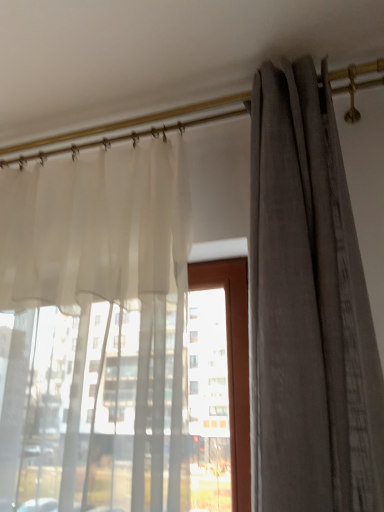
Locate an element on the screen. gray textured curtain at right, which is the 1th curtain in right-to-left order is located at coordinates (308, 309).

What do you see at coordinates (308, 309) in the screenshot? I see `gray textured curtain at right, which is the 1th curtain in right-to-left order` at bounding box center [308, 309].

Measure the distance between point (260, 86) and camera.

The distance of point (260, 86) from camera is 3.66 feet.

This screenshot has width=384, height=512. In order to click on translucent white curtain at left, placed as the 2th curtain when sorted from right to left in this screenshot , I will do `click(96, 332)`.

How much space does translucent white curtain at left, placed as the 2th curtain when sorted from right to left, occupy horizontally?

translucent white curtain at left, placed as the 2th curtain when sorted from right to left, is 11.16 inches in width.

How much space does translucent white curtain at left, placed as the 2th curtain when sorted from right to left, occupy vertically?

translucent white curtain at left, placed as the 2th curtain when sorted from right to left, is 3.54 feet in height.

The width and height of the screenshot is (384, 512). What do you see at coordinates (96, 332) in the screenshot? I see `translucent white curtain at left, placed as the 2th curtain when sorted from right to left` at bounding box center [96, 332].

You are a GUI agent. You are given a task and a screenshot of the screen. Output one action in this format:
    pyautogui.click(x=<x>, y=<y>)
    Task: Click on the gray textured curtain at right, arranged as the 2th curtain when viewed from the left
    The image size is (384, 512).
    Given the screenshot: What is the action you would take?
    pyautogui.click(x=308, y=309)

Considering the relative positions of translucent white curtain at left, placed as the first curtain when sorted from left to right, and gray textured curtain at right, arranged as the 2th curtain when viewed from the left, in the image provided, is translucent white curtain at left, placed as the first curtain when sorted from left to right, to the right of gray textured curtain at right, arranged as the 2th curtain when viewed from the left, from the viewer's perspective?

No.

Is the position of translucent white curtain at left, placed as the 2th curtain when sorted from right to left, more distant than that of gray textured curtain at right, arranged as the 2th curtain when viewed from the left?

Yes.

Does point (33, 359) appear closer or farther from the camera than point (356, 461)?

Point (33, 359) appears to be farther away from the viewer than point (356, 461).

From the image's perspective, is translucent white curtain at left, placed as the 2th curtain when sorted from right to left, located beneath gray textured curtain at right, which is the 1th curtain in right-to-left order?

Correct, translucent white curtain at left, placed as the 2th curtain when sorted from right to left, appears lower than gray textured curtain at right, which is the 1th curtain in right-to-left order, in the image.

From a real-world perspective, between translucent white curtain at left, placed as the 2th curtain when sorted from right to left, and gray textured curtain at right, which is the 1th curtain in right-to-left order, who is vertically lower?

From a 3D spatial view, translucent white curtain at left, placed as the 2th curtain when sorted from right to left, is below.

Between translucent white curtain at left, placed as the first curtain when sorted from left to right, and gray textured curtain at right, which is the 1th curtain in right-to-left order, which one has larger width?

gray textured curtain at right, which is the 1th curtain in right-to-left order.

Between translucent white curtain at left, placed as the 2th curtain when sorted from right to left, and gray textured curtain at right, which is the 1th curtain in right-to-left order, which one has less height?

With less height is translucent white curtain at left, placed as the 2th curtain when sorted from right to left.

Considering the sizes of objects translucent white curtain at left, placed as the first curtain when sorted from left to right, and gray textured curtain at right, which is the 1th curtain in right-to-left order, in the image provided, who is smaller, translucent white curtain at left, placed as the first curtain when sorted from left to right, or gray textured curtain at right, which is the 1th curtain in right-to-left order,?

Smaller between the two is gray textured curtain at right, which is the 1th curtain in right-to-left order.

Does translucent white curtain at left, placed as the 2th curtain when sorted from right to left, contain gray textured curtain at right, arranged as the 2th curtain when viewed from the left?

No, gray textured curtain at right, arranged as the 2th curtain when viewed from the left, is not a part of translucent white curtain at left, placed as the 2th curtain when sorted from right to left.

Are translucent white curtain at left, placed as the 2th curtain when sorted from right to left, and gray textured curtain at right, arranged as the 2th curtain when viewed from the left, beside each other?

No, translucent white curtain at left, placed as the 2th curtain when sorted from right to left, is not next to gray textured curtain at right, arranged as the 2th curtain when viewed from the left.

Is translucent white curtain at left, placed as the first curtain when sorted from left to right, oriented towards gray textured curtain at right, arranged as the 2th curtain when viewed from the left?

No, translucent white curtain at left, placed as the first curtain when sorted from left to right, is not aimed at gray textured curtain at right, arranged as the 2th curtain when viewed from the left.

Where is `curtain located behind the gray textured curtain at right, arranged as the 2th curtain when viewed from the left`? The image size is (384, 512). curtain located behind the gray textured curtain at right, arranged as the 2th curtain when viewed from the left is located at coordinates (96, 332).

Which is more to the right, gray textured curtain at right, which is the 1th curtain in right-to-left order, or translucent white curtain at left, placed as the first curtain when sorted from left to right?

From the viewer's perspective, gray textured curtain at right, which is the 1th curtain in right-to-left order, appears more on the right side.

Which object is closer to the camera, gray textured curtain at right, arranged as the 2th curtain when viewed from the left, or translucent white curtain at left, placed as the first curtain when sorted from left to right?

Positioned in front is gray textured curtain at right, arranged as the 2th curtain when viewed from the left.

Is point (333, 124) less distant than point (24, 261)?

Yes.

From the image's perspective, is gray textured curtain at right, arranged as the 2th curtain when viewed from the left, below translucent white curtain at left, placed as the first curtain when sorted from left to right?

Incorrect, from the image's perspective, gray textured curtain at right, arranged as the 2th curtain when viewed from the left, is higher than translucent white curtain at left, placed as the first curtain when sorted from left to right.

From a real-world perspective, between gray textured curtain at right, which is the 1th curtain in right-to-left order, and translucent white curtain at left, placed as the first curtain when sorted from left to right, who is vertically lower?

From a 3D spatial view, translucent white curtain at left, placed as the first curtain when sorted from left to right, is below.

Considering the sizes of gray textured curtain at right, which is the 1th curtain in right-to-left order, and translucent white curtain at left, placed as the first curtain when sorted from left to right, in the image, is gray textured curtain at right, which is the 1th curtain in right-to-left order, wider or thinner than translucent white curtain at left, placed as the first curtain when sorted from left to right,?

Considering their sizes, gray textured curtain at right, which is the 1th curtain in right-to-left order, looks broader than translucent white curtain at left, placed as the first curtain when sorted from left to right.

Looking at this image, does gray textured curtain at right, which is the 1th curtain in right-to-left order, have a lesser height compared to translucent white curtain at left, placed as the first curtain when sorted from left to right?

Incorrect, the height of gray textured curtain at right, which is the 1th curtain in right-to-left order, does not fall short of that of translucent white curtain at left, placed as the first curtain when sorted from left to right.

Is gray textured curtain at right, which is the 1th curtain in right-to-left order, bigger or smaller than translucent white curtain at left, placed as the 2th curtain when sorted from right to left?

Clearly, gray textured curtain at right, which is the 1th curtain in right-to-left order, is smaller in size than translucent white curtain at left, placed as the 2th curtain when sorted from right to left.

Consider the image. Could translucent white curtain at left, placed as the first curtain when sorted from left to right, be considered to be inside gray textured curtain at right, arranged as the 2th curtain when viewed from the left?

No.

Are gray textured curtain at right, which is the 1th curtain in right-to-left order, and translucent white curtain at left, placed as the first curtain when sorted from left to right, beside each other?

No, gray textured curtain at right, which is the 1th curtain in right-to-left order, is not next to translucent white curtain at left, placed as the first curtain when sorted from left to right.

Is gray textured curtain at right, which is the 1th curtain in right-to-left order, facing away from translucent white curtain at left, placed as the first curtain when sorted from left to right?

No.

Locate an element on the screen. The image size is (384, 512). curtain on the right of translucent white curtain at left, placed as the 2th curtain when sorted from right to left is located at coordinates (308, 309).

The image size is (384, 512). Find the location of `curtain below the gray textured curtain at right, arranged as the 2th curtain when viewed from the left (from the image's perspective)`. curtain below the gray textured curtain at right, arranged as the 2th curtain when viewed from the left (from the image's perspective) is located at coordinates (96, 332).

Where is `curtain behind the gray textured curtain at right, which is the 1th curtain in right-to-left order`? This screenshot has height=512, width=384. curtain behind the gray textured curtain at right, which is the 1th curtain in right-to-left order is located at coordinates (96, 332).